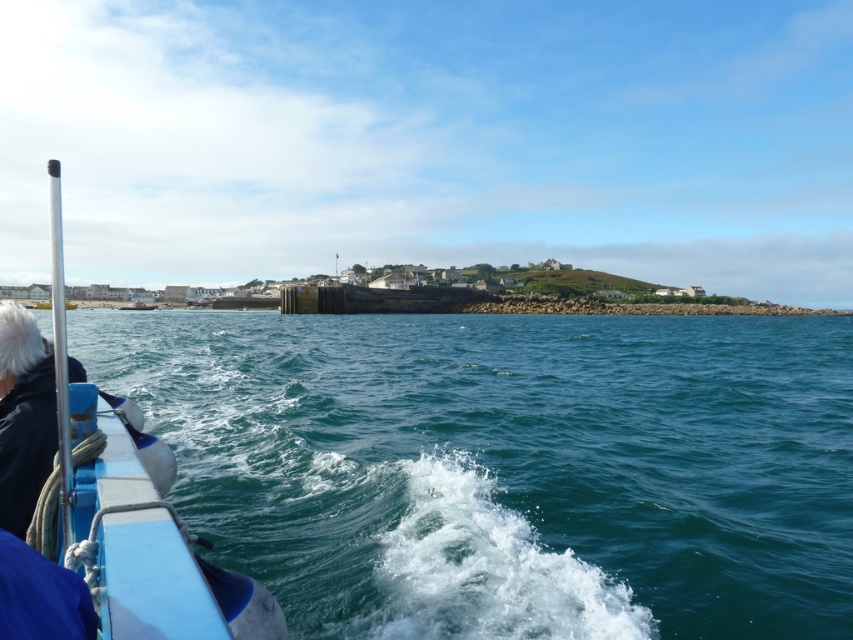
Which is more to the right, teal water at lower left or blue rubber boat at left?

From the viewer's perspective, teal water at lower left appears more on the right side.

Consider the image. Does teal water at lower left have a greater width compared to blue rubber boat at left?

Yes.

Which is behind, point (410, 336) or point (74, 368)?

The point (410, 336) is more distant.

Find the location of a particular element. teal water at lower left is located at coordinates (506, 467).